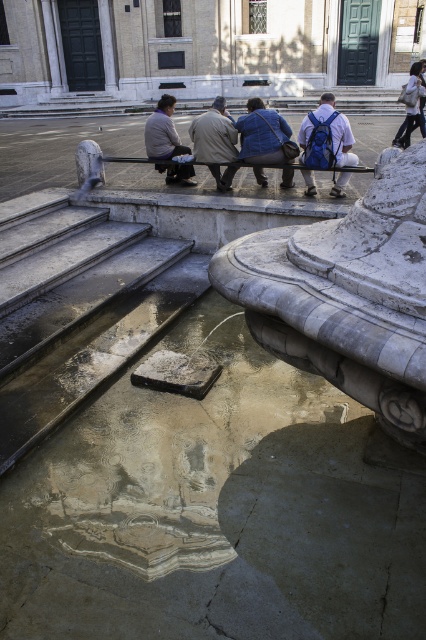
Between point (319, 106) and point (406, 124), which one is positioned behind?

Positioned behind is point (319, 106).

Can you confirm if matte blue backpack at center is shorter than white fabric bag at upper right?

Yes, matte blue backpack at center is shorter than white fabric bag at upper right.

What are the coordinates of `matte blue backpack at center` in the screenshot? It's located at (342, 140).

Where is `matte blue backpack at center`? Image resolution: width=426 pixels, height=640 pixels. matte blue backpack at center is located at coordinates (342, 140).

Which is in front, point (423, 339) or point (302, 145)?

Point (423, 339)

Between white marble fountain at center and matte blue backpack at center, which one is positioned higher?

matte blue backpack at center is above.

At what (x,y) coordinates should I click in order to perform the action: click on white marble fountain at center. Please return your answer as a coordinate pair (x, y). The image size is (426, 640). Looking at the image, I should click on (347, 296).

Where is `white marble fountain at center`? The width and height of the screenshot is (426, 640). white marble fountain at center is located at coordinates (347, 296).

Is khaki cotton pants at center thinner than white fabric bag at upper right?

Indeed, khaki cotton pants at center has a lesser width compared to white fabric bag at upper right.

Is khaki cotton pants at center to the right of white fabric bag at upper right from the viewer's perspective?

No, khaki cotton pants at center is not to the right of white fabric bag at upper right.

Which is behind, point (226, 189) or point (403, 144)?

Point (403, 144)

Where is `khaki cotton pants at center`? The height and width of the screenshot is (640, 426). khaki cotton pants at center is located at coordinates (213, 134).